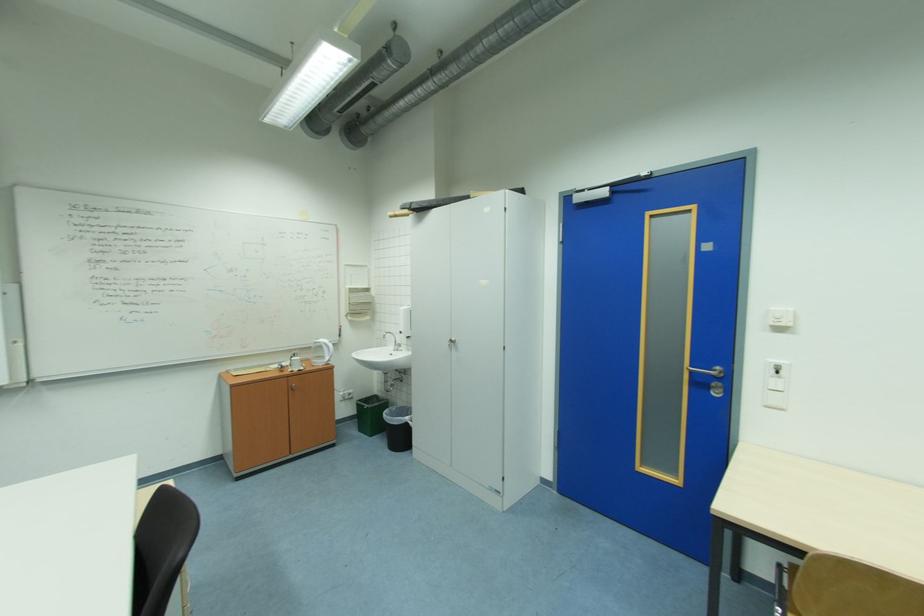
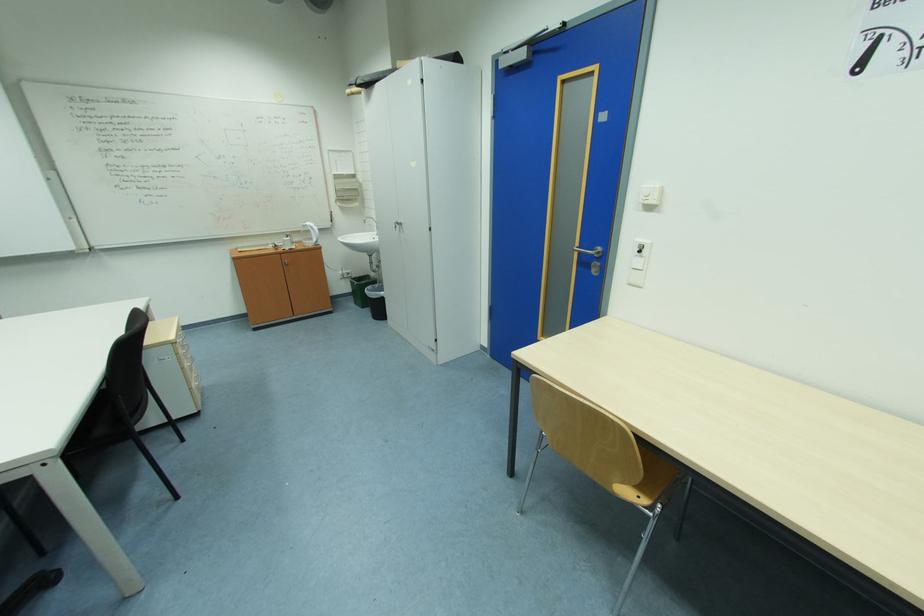
Find the pixel in the second image that matches the point at 456,346 in the first image.

(403, 228)